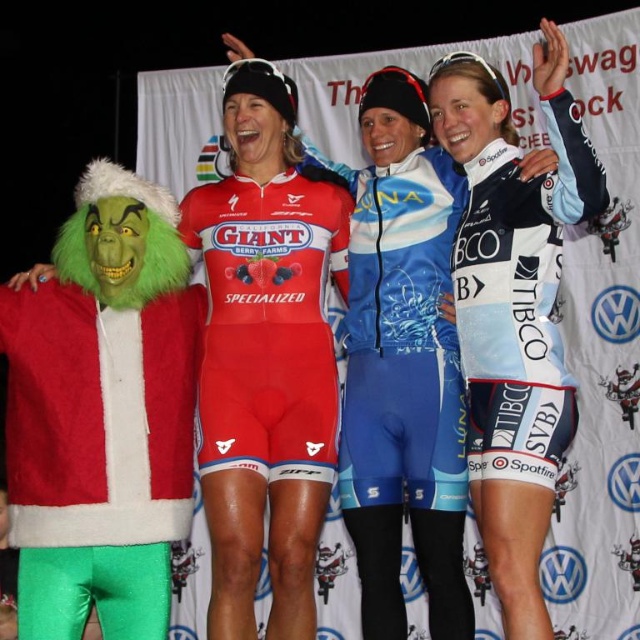
Is matte red cycling suit at center positioned behind white/blue jersey at center?

Yes, it is.

Between point (272, 429) and point (477, 278), which one is positioned in front?

Point (477, 278) is in front.

Locate an element on the screen. This screenshot has height=640, width=640. matte red cycling suit at center is located at coordinates tap(268, 323).

In the scene shown: Is white/blue jersey at center further to camera compared to blue matte cycling jersey at center?

No, it is not.

Does white/blue jersey at center have a larger size compared to blue matte cycling jersey at center?

Yes, white/blue jersey at center is bigger than blue matte cycling jersey at center.

Is point (564, 99) positioned behind point (396, 417)?

No.

Image resolution: width=640 pixels, height=640 pixels. I want to click on white/blue jersey at center, so click(520, 298).

Is fuzzy red santa coat at left further to the viewer compared to matte red cycling suit at center?

That is True.

Does fuzzy red santa coat at left have a larger size compared to matte red cycling suit at center?

Indeed, fuzzy red santa coat at left has a larger size compared to matte red cycling suit at center.

Who is more distant from viewer, (77, 413) or (225, 339)?

The point (225, 339) is behind.

Identify the location of fuzzy red santa coat at left. The width and height of the screenshot is (640, 640). (97, 436).